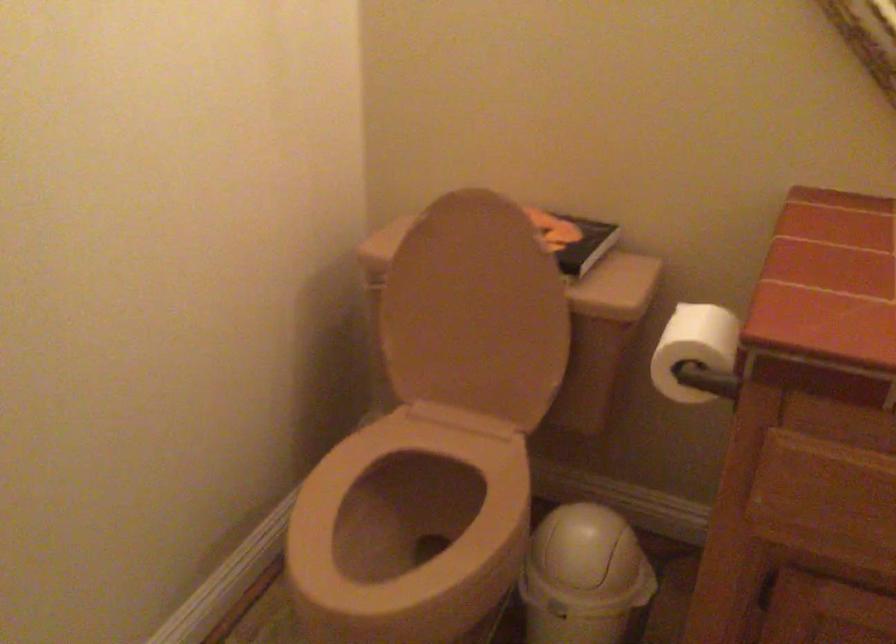
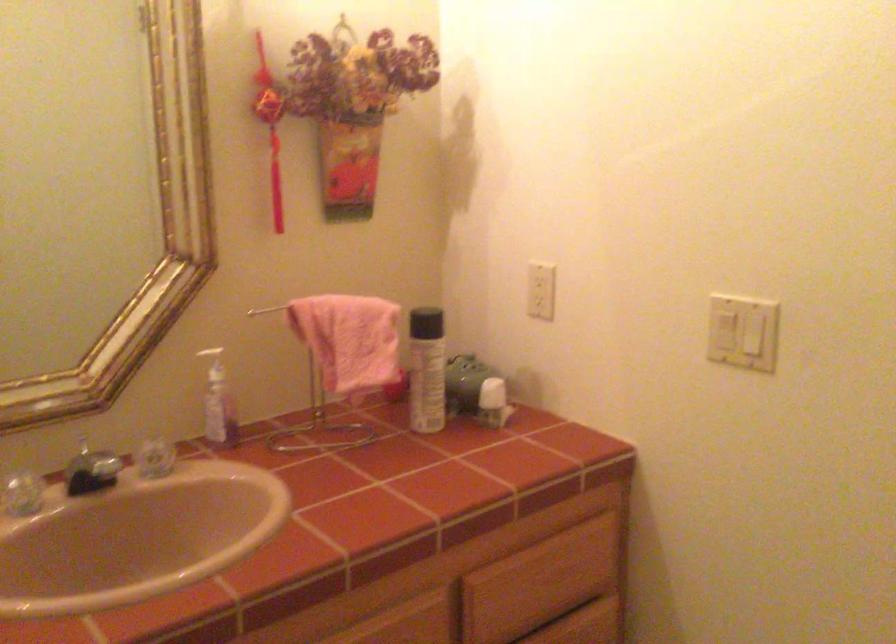
Question: The camera is either moving clockwise (left) or counter-clockwise (right) around the object. The first image is from the beginning of the video and the second image is from the end. Is the camera moving left or right when shooting the video?

Choices:
 (A) Left
 (B) Right

Answer: (A)